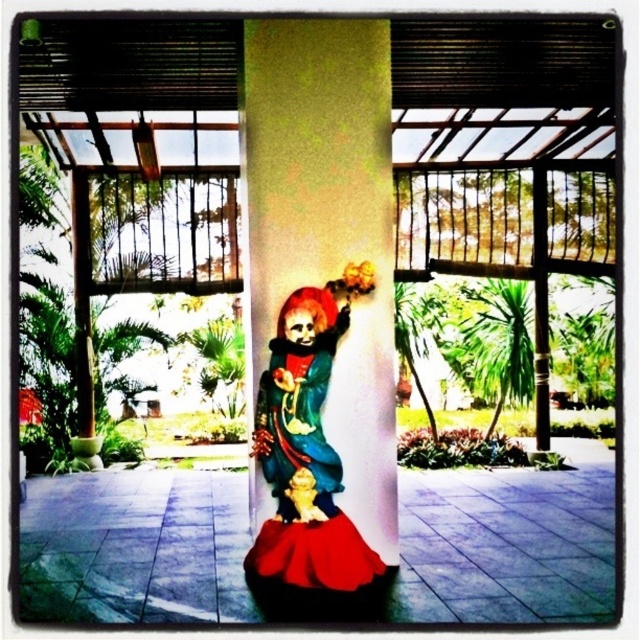
Does matte yellow pillar at center appear on the right side of gold metallic statue at center?

Correct, you'll find matte yellow pillar at center to the right of gold metallic statue at center.

Does point (268, 205) lie behind point (308, 497)?

Yes, it is behind point (308, 497).

The height and width of the screenshot is (640, 640). What are the coordinates of `matte yellow pillar at center` in the screenshot? It's located at (326, 225).

Does matte red dress at center appear on the left side of gold metallic statue at center?

Correct, you'll find matte red dress at center to the left of gold metallic statue at center.

Measure the distance between matte red dress at center and gold metallic statue at center.

matte red dress at center and gold metallic statue at center are 7.81 inches apart.

Which is behind, point (301, 372) or point (323, 512)?

The point (323, 512) is more distant.

Find the location of a particular element. matte red dress at center is located at coordinates (296, 419).

Does matte yellow pillar at center appear over matte red dress at center?

Yes.

Image resolution: width=640 pixels, height=640 pixels. What do you see at coordinates (326, 225) in the screenshot?
I see `matte yellow pillar at center` at bounding box center [326, 225].

What are the coordinates of `matte yellow pillar at center` in the screenshot? It's located at (326, 225).